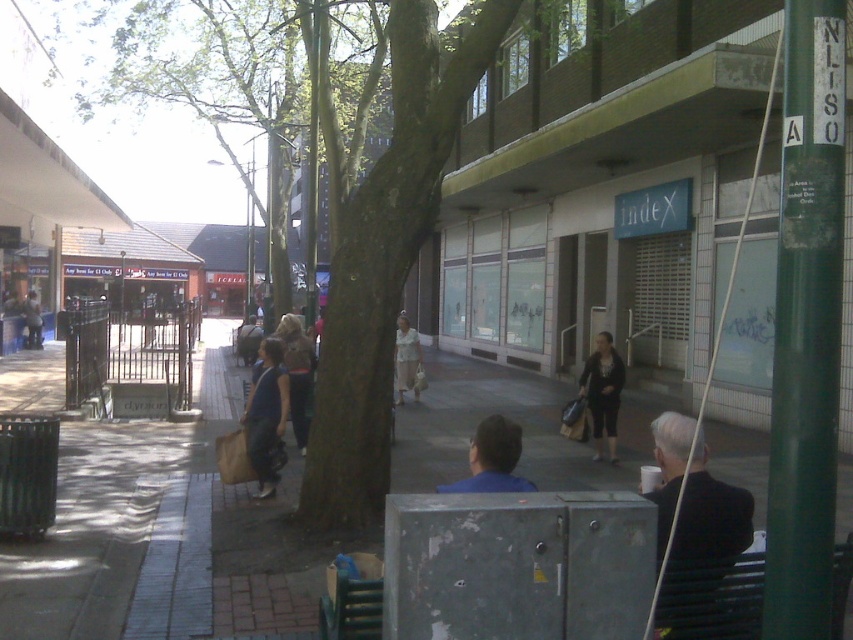
Does smooth concrete pavement at center appear on the right side of matte blue shirt at center?

Indeed, smooth concrete pavement at center is positioned on the right side of matte blue shirt at center.

Identify the location of smooth concrete pavement at center. The width and height of the screenshot is (853, 640). (160, 534).

Does metallic dark green bench at lower right appear on the left side of matte brown shirt at center?

In fact, metallic dark green bench at lower right is to the right of matte brown shirt at center.

The width and height of the screenshot is (853, 640). What do you see at coordinates (712, 600) in the screenshot?
I see `metallic dark green bench at lower right` at bounding box center [712, 600].

Between point (752, 556) and point (302, 372), which one is positioned behind?

Positioned behind is point (302, 372).

Locate an element on the screen. The height and width of the screenshot is (640, 853). metallic dark green bench at lower right is located at coordinates [x=712, y=600].

Which of these two, smooth concrete pavement at center or blue shirt at center, stands shorter?

Standing shorter between the two is blue shirt at center.

Between smooth concrete pavement at center and blue shirt at center, which one has more height?

smooth concrete pavement at center is taller.

This screenshot has height=640, width=853. Find the location of `smooth concrete pavement at center`. smooth concrete pavement at center is located at coordinates (160, 534).

What are the coordinates of `smooth concrete pavement at center` in the screenshot? It's located at (160, 534).